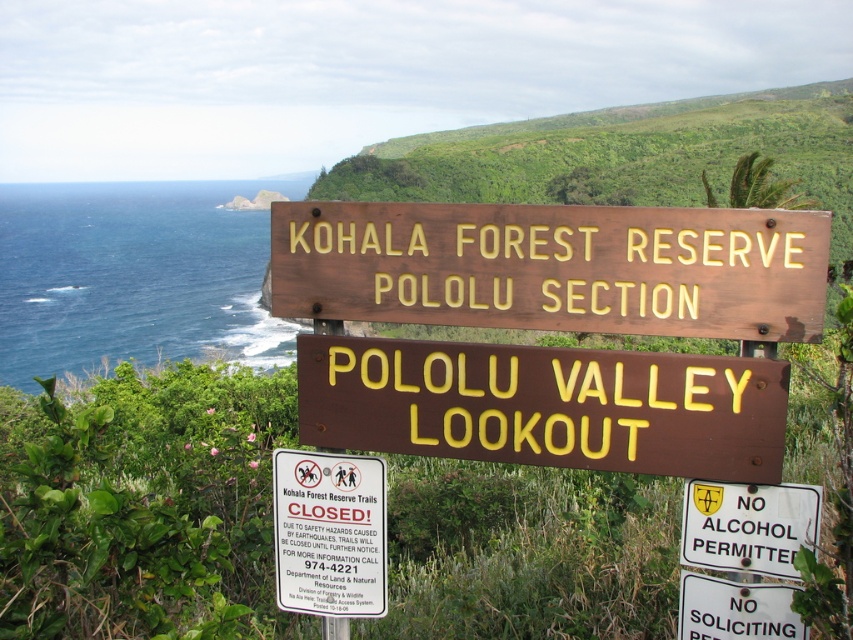
Which of these two, white paper sign at center or white plastic sign at center, stands taller?

With more height is white paper sign at center.

Who is shorter, white paper sign at center or white plastic sign at center?

white plastic sign at center

Identify the location of white paper sign at center. (329, 532).

Is brown polished wood sign at center wider than white plastic sign at center?

Indeed, brown polished wood sign at center has a greater width compared to white plastic sign at center.

Is point (497, 346) behind point (767, 564)?

Yes, point (497, 346) is farther from viewer.

Identify the location of brown polished wood sign at center. The width and height of the screenshot is (853, 640). (546, 404).

Who is taller, brown wooden sign at center or white plastic sign at lower right?

brown wooden sign at center

Is the position of brown wooden sign at center more distant than that of white plastic sign at lower right?

No, brown wooden sign at center is in front of white plastic sign at lower right.

Does point (706, 250) lie in front of point (729, 616)?

That is True.

Identify the location of brown wooden sign at center. This screenshot has width=853, height=640. (554, 268).